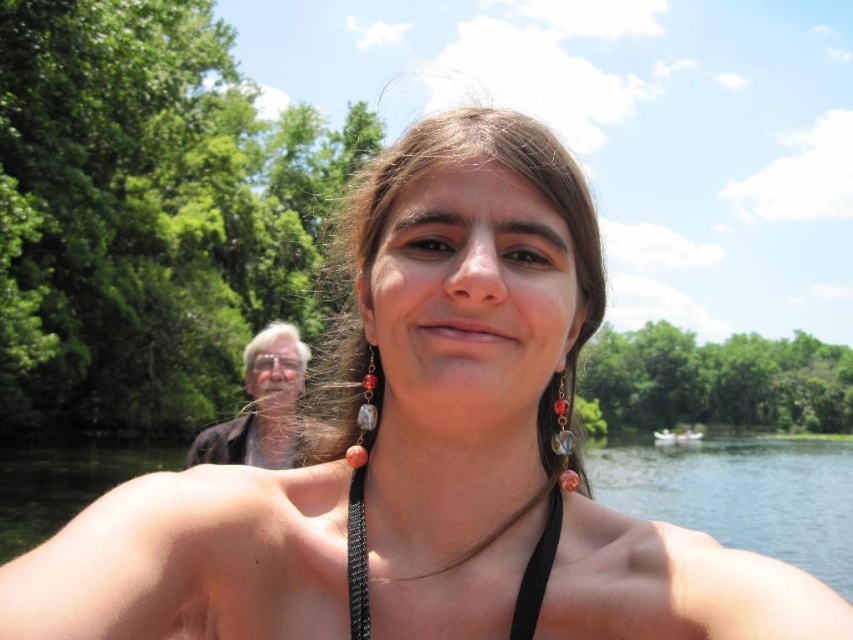
Question: Does black mesh bikini top at center have a lesser width compared to white plastic boat at lower right?

Choices:
 (A) yes
 (B) no

Answer: (A)

Question: Estimate the real-world distances between objects in this image. Which object is farther from the white plastic boat at lower right?

Choices:
 (A) clear water at center
 (B) black mesh bikini top at center

Answer: (B)

Question: Which of the following is the farthest from the observer?

Choices:
 (A) clear water at center
 (B) black mesh bikini top at center

Answer: (A)

Question: Where is black mesh bikini top at center located in relation to white plastic boat at lower right in the image?

Choices:
 (A) right
 (B) left

Answer: (B)

Question: Does clear water at center have a larger size compared to white plastic boat at lower right?

Choices:
 (A) yes
 (B) no

Answer: (A)

Question: Which point is farther to the camera?

Choices:
 (A) (349, 529)
 (B) (694, 442)
 (C) (817, 525)

Answer: (B)